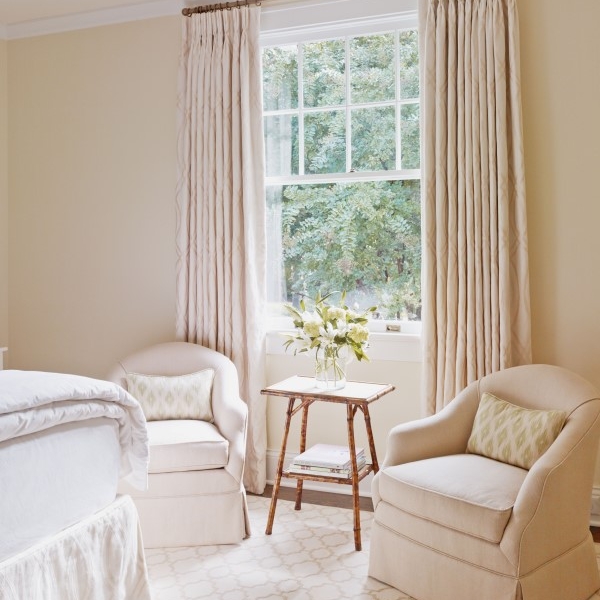
At what (x,y) coordinates should I click in order to perform the action: click on white mattress. Please return your answer as a coordinate pair (x, y). Looking at the image, I should click on (32, 480).